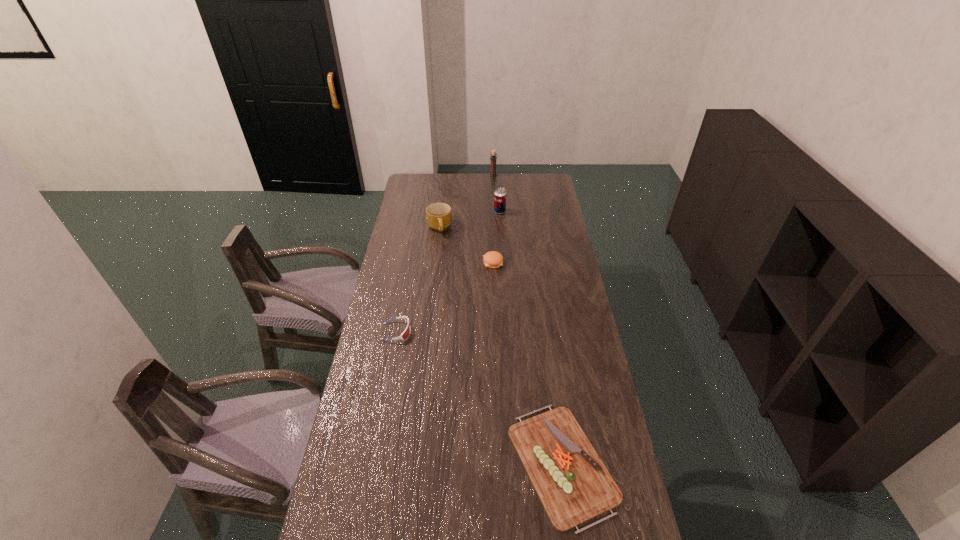
You are a GUI agent. You are given a task and a screenshot of the screen. Output one action in this format:
    pyautogui.click(x=<x>, y=<y>)
    Task: Click on the free space at the far edge of the desktop
    The image size is (960, 540).
    Given the screenshot: What is the action you would take?
    pyautogui.click(x=456, y=192)

The height and width of the screenshot is (540, 960). In the image, there is a desktop. Find the location of `vacant area at the left edge`. vacant area at the left edge is located at coordinates (403, 397).

Where is `free space between the mug and the nearest object`? free space between the mug and the nearest object is located at coordinates (501, 346).

Locate an element on the screen. unoccupied area between the patty and the chopping board is located at coordinates (528, 363).

The height and width of the screenshot is (540, 960). In order to click on free space between the fifth nearest object and the fourth shortest object in this screenshot , I will do `click(469, 220)`.

Find the location of a particular element. empty space that is in between the shortest object and the fifth farthest object is located at coordinates (479, 397).

Find the location of `empty space between the third tallest object and the second tallest object`. empty space between the third tallest object and the second tallest object is located at coordinates (469, 220).

You are a GUI agent. You are given a task and a screenshot of the screen. Output one action in this format:
    pyautogui.click(x=<x>, y=<y>)
    Task: Click on the empty space between the candle holder and the fifth farthest object
    The height and width of the screenshot is (540, 960).
    Given the screenshot: What is the action you would take?
    pyautogui.click(x=444, y=253)

I want to click on free space between the nearest object and the tallest object, so click(x=528, y=319).

What are the coordinates of `vacant region between the beer can and the fifth farthest object` in the screenshot? It's located at (448, 272).